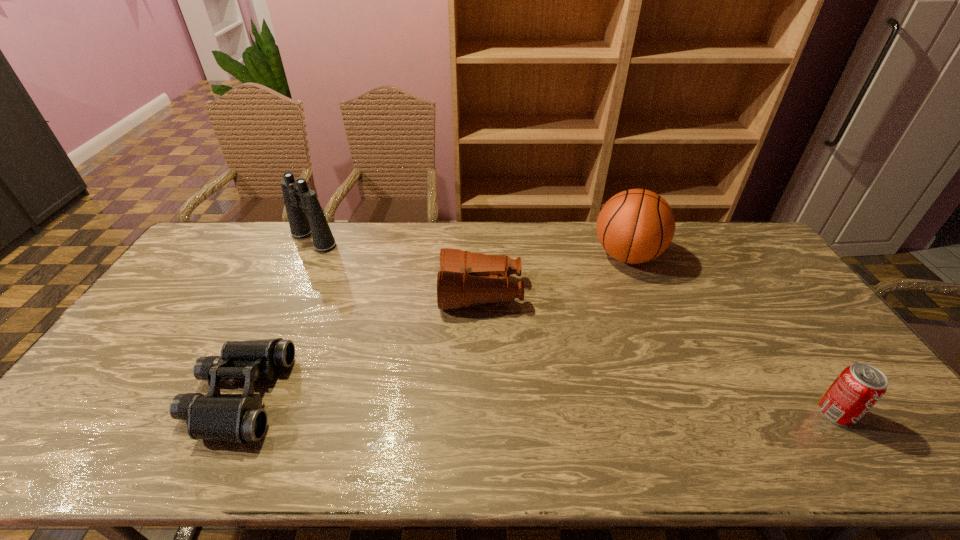
You are a GUI agent. You are given a task and a screenshot of the screen. Output one action in this format:
    pyautogui.click(x=<x>, y=<y>)
    Task: Click on the vacant space that is in between the tallest binoculars and the third object from left to right
    
    Given the screenshot: What is the action you would take?
    point(397,266)

The width and height of the screenshot is (960, 540). Find the location of `vacant area that lies between the fourth object from left to right and the tallest binoculars`. vacant area that lies between the fourth object from left to right and the tallest binoculars is located at coordinates (470, 247).

Identify which object is the closest to the farthest binoculars. Please provide its 2D coordinates. Your answer should be formatted as a tuple, i.e. [(x, y)], where the tuple contains the x and y coordinates of a point satisfying the conditions above.

[(465, 278)]

This screenshot has width=960, height=540. What are the coordinates of `object that stands as the fourth closest to the basketball` in the screenshot? It's located at (239, 418).

Identify which binoculars is the nearest to the second farthest binoculars. Please provide its 2D coordinates. Your answer should be formatted as a tuple, i.e. [(x, y)], where the tuple contains the x and y coordinates of a point satisfying the conditions above.

[(239, 418)]

Locate an element on the screen. binoculars that stands as the closest to the nearest binoculars is located at coordinates (465, 278).

This screenshot has width=960, height=540. I want to click on vacant space that satisfies the following two spatial constraints: 1. on the front side of the basketball; 2. on the front-facing side of the nearest binoculars, so click(684, 396).

Locate an element on the screen. Image resolution: width=960 pixels, height=540 pixels. free location that satisfies the following two spatial constraints: 1. on the back side of the soda can; 2. on the front-facing side of the nearest binoculars is located at coordinates (825, 396).

Where is `blank area in the image that satisfies the following two spatial constraints: 1. through the lenses of the second farthest binoculars; 2. on the back side of the rightmost object`? blank area in the image that satisfies the following two spatial constraints: 1. through the lenses of the second farthest binoculars; 2. on the back side of the rightmost object is located at coordinates (481, 413).

Identify the location of free point that satisfies the following two spatial constraints: 1. on the front side of the farthest binoculars; 2. on the left side of the fourth object from left to right. (305, 256).